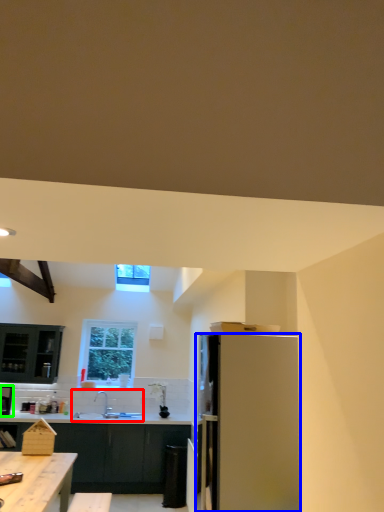
Question: Estimate the real-world distances between objects in this image. Which object is closer to sink (highlighted by a red box), refrigerator (highlighted by a blue box) or kitchen appliance (highlighted by a green box)?

Choices:
 (A) refrigerator
 (B) kitchen appliance

Answer: (B)